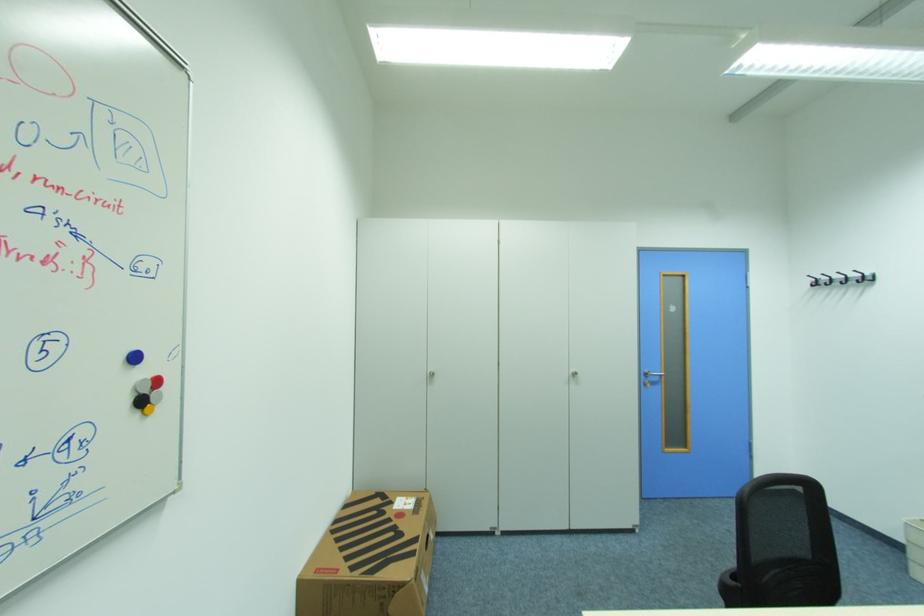
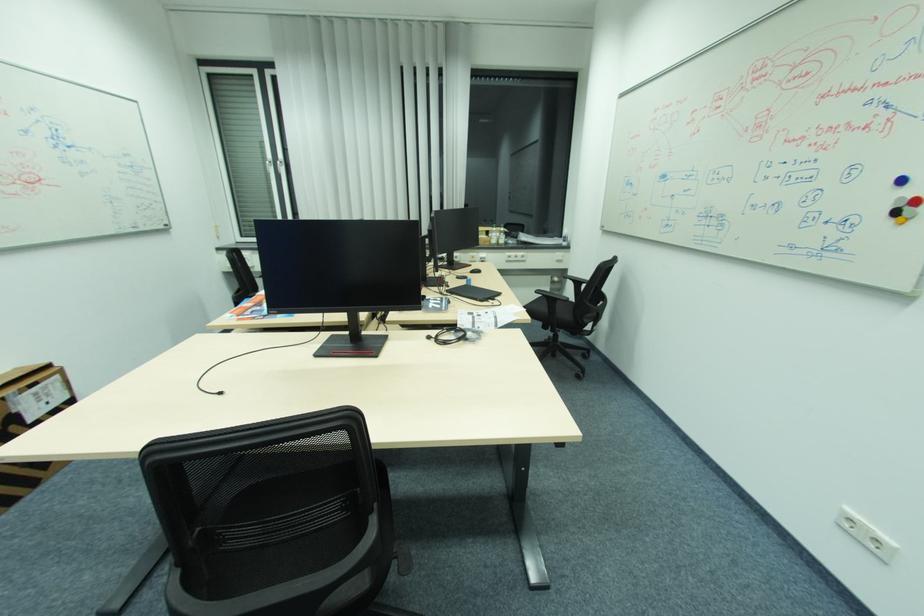
Find the pixel in the second image that matches [151,391] in the first image.

(907, 206)